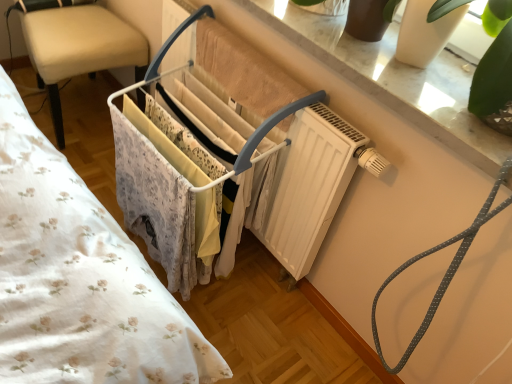
Question: Is beige leather chair at left inside the boundaries of white marble window sill at upper center, or outside?

Choices:
 (A) inside
 (B) outside

Answer: (B)

Question: Is beige leather chair at left bigger or smaller than white marble window sill at upper center?

Choices:
 (A) big
 (B) small

Answer: (A)

Question: Based on their relative distances, which object is farther from the beige leather chair at left?

Choices:
 (A) white plastic clothes rack at center
 (B) gray dotted rope at upper right
 (C) white marble window sill at upper center

Answer: (B)

Question: Estimate the real-world distances between objects in this image. Which object is farther from the gray dotted rope at upper right?

Choices:
 (A) white plastic clothes rack at center
 (B) white marble window sill at upper center
 (C) beige leather chair at left

Answer: (C)